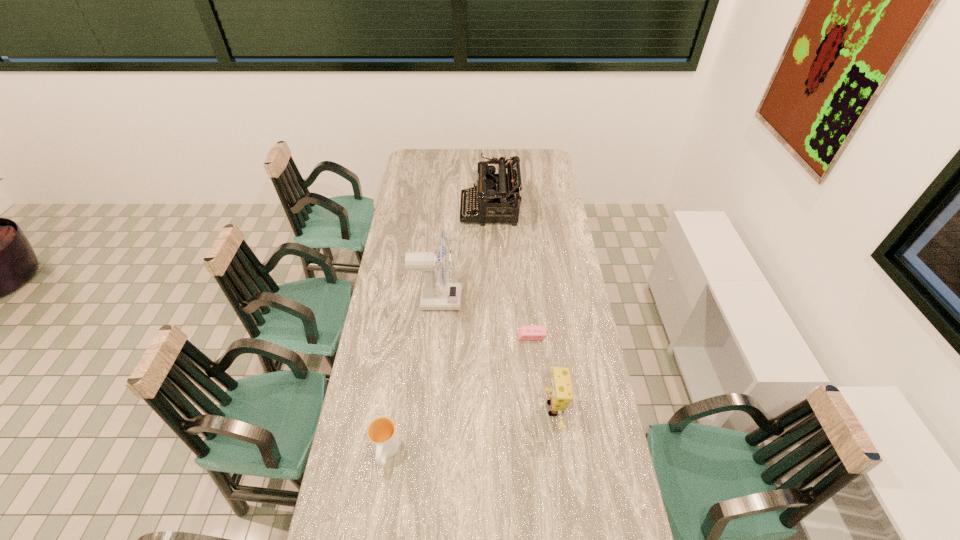
Locate an element on the screen. vacant space that is in between the eraser and the second shortest object is located at coordinates (459, 394).

At what (x,y) coordinates should I click in order to perform the action: click on free area in between the farthest object and the fourth tallest object. Please return your answer as a coordinate pair (x, y). The height and width of the screenshot is (540, 960). Looking at the image, I should click on (438, 331).

In order to click on free space between the farthest object and the shortest object in this screenshot , I will do `click(511, 273)`.

Select which object appears as the fourth closest to the farthest object. Please provide its 2D coordinates. Your answer should be formatted as a tuple, i.e. [(x, y)], where the tuple contains the x and y coordinates of a point satisfying the conditions above.

[(382, 433)]

You are a GUI agent. You are given a task and a screenshot of the screen. Output one action in this format:
    pyautogui.click(x=<x>, y=<y>)
    Task: Click on the third closest object relative to the farthest object
    This screenshot has height=540, width=960.
    Given the screenshot: What is the action you would take?
    pyautogui.click(x=561, y=393)

Image resolution: width=960 pixels, height=540 pixels. Find the location of `blank space that satisfies the following two spatial constraints: 1. on the back side of the third farthest object; 2. on the keyboard of the typewriter`. blank space that satisfies the following two spatial constraints: 1. on the back side of the third farthest object; 2. on the keyboard of the typewriter is located at coordinates (519, 210).

What are the coordinates of `free region that satisfies the following two spatial constraints: 1. on the keyboard of the typewriter; 2. with the handle on the side of the cup` in the screenshot? It's located at (497, 453).

At what (x,y) coordinates should I click in order to perform the action: click on blank space that satisfies the following two spatial constraints: 1. on the keyboard of the typewriter; 2. on the right side of the third nearest object. Please return your answer as a coordinate pair (x, y). This screenshot has height=540, width=960. Looking at the image, I should click on (493, 335).

You are a GUI agent. You are given a task and a screenshot of the screen. Output one action in this format:
    pyautogui.click(x=<x>, y=<y>)
    Task: Click on the vacant space that satisfies the following two spatial constraints: 1. on the keyboard of the fourth shortest object; 2. with the handle on the side of the cup
    
    Given the screenshot: What is the action you would take?
    pyautogui.click(x=497, y=453)

The image size is (960, 540). I want to click on vacant point that satisfies the following two spatial constraints: 1. on the keyboard of the second tallest object; 2. on the right side of the third nearest object, so click(x=493, y=335).